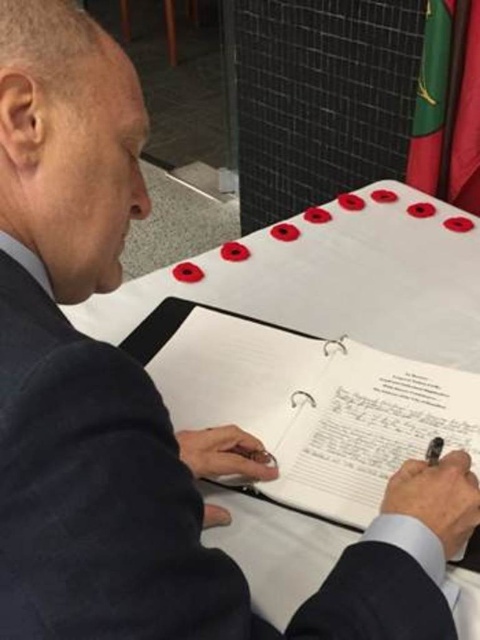
Based on the photo, you are standing in front of the table and want to place a small object on the table. You have two options for placement based on coordinates given in the scene. Which coordinate point, point (377, 419) or point (416, 134), is closer to you when viewed from your current position?

Point (377, 419) is closer to the viewer than point (416, 134).

You are standing in front of the scene and want to place a small sticker exactly at the point labeled as point (266, 440). If your hand can reach up to 70 centimeters, will you be able to reach that point?

The point (266, 440) is 75.21 centimeters away from the viewer, which is beyond the 70 centimeter reach. Therefore, you cannot reach it.

You are organizing a small event and need to display both the white paper at center and the green fabric flag at upper right. Which object should you choose if you want the larger one for a prominent display?

The white paper at center is larger in size than the green fabric flag at upper right, so you should choose the white paper at center for a prominent display.